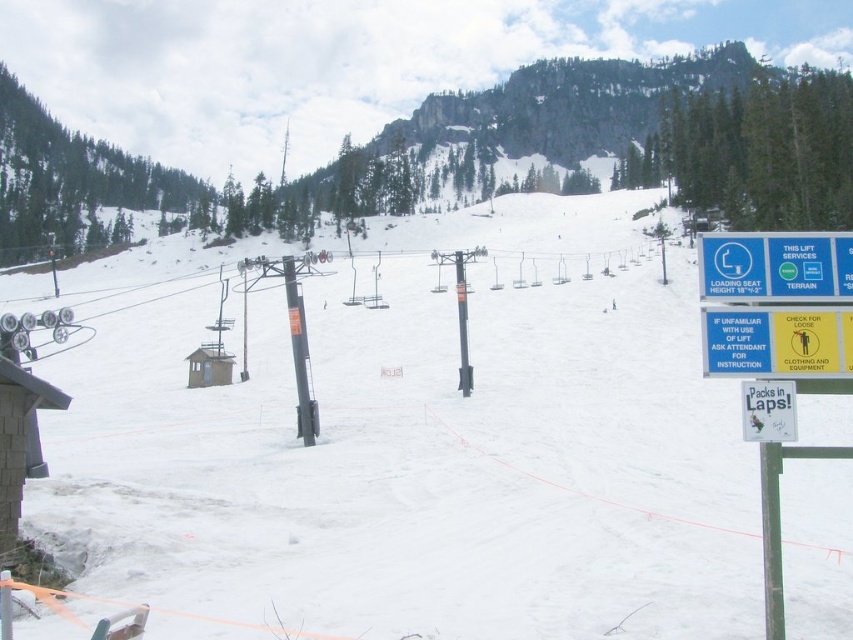
You are a skier standing at the base of the slope and looking up towards the ski lift. You notice two points marked in the scene. Which point, point [262,380] or point [740,262], is closer to you?

Point [262,380] is closer to you because it is further to the viewer than point [740,262].